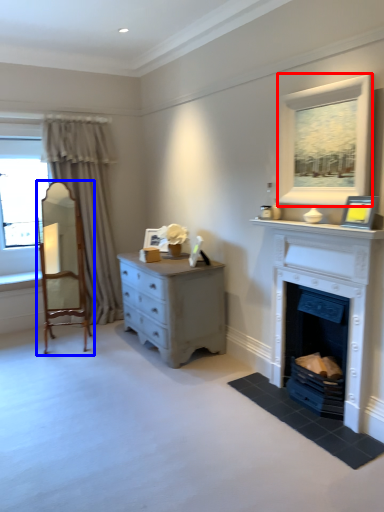
Question: Among these objects, which one is nearest to the camera, window (highlighted by a red box) or armchair (highlighted by a blue box)?

Choices:
 (A) window
 (B) armchair

Answer: (A)